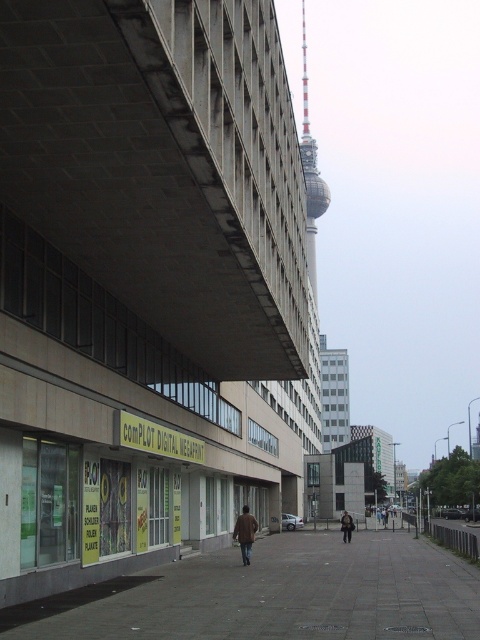
You are standing on the gray concrete pavement at center. What are the coordinates of your current position?

The coordinates of the gray concrete pavement at center are point (x=287, y=595).

You are standing on the street looking at the large modern building. There is a point labeled as point (165, 166) on the image. What is located at that point?

The point (165, 166) corresponds to the concrete at upper left.

You are standing on the sidewalk in front of the building. You want to locate the concrete at upper left mentioned in the scene. Where should you look?

The concrete at upper left is located at point coordinates (165,166).